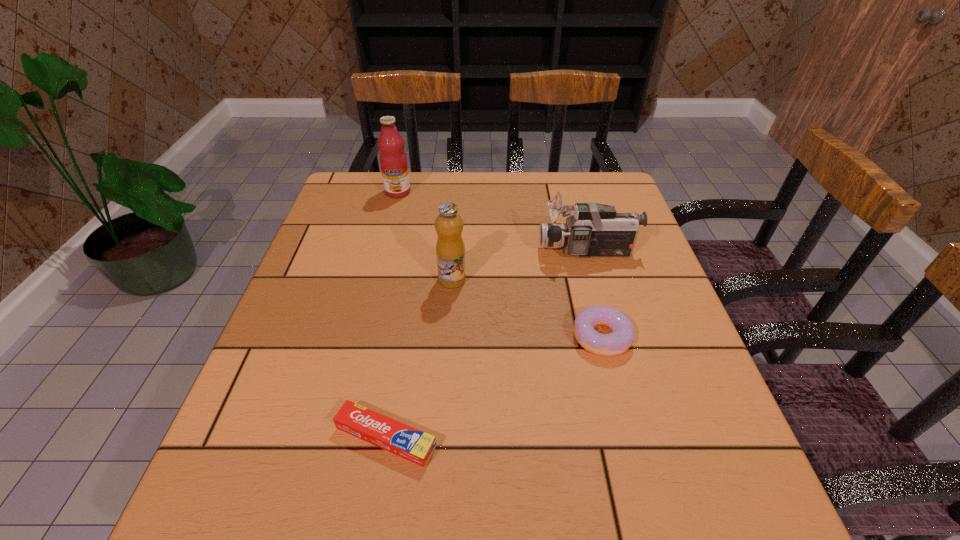
Locate an element on the screen. This screenshot has height=540, width=960. free space located 0.220m on the label of the left fruit juice is located at coordinates (384, 246).

Locate an element on the screen. free space located on the front label of the nearer fruit juice is located at coordinates (x=525, y=280).

You are a GUI agent. You are given a task and a screenshot of the screen. Output one action in this format:
    pyautogui.click(x=<x>, y=<y>)
    Task: Click on the vacant space situated on the front-facing side of the camcorder
    Image resolution: width=960 pixels, height=540 pixels.
    Given the screenshot: What is the action you would take?
    pyautogui.click(x=468, y=251)

Where is `vacant space located on the front-facing side of the camcorder`? vacant space located on the front-facing side of the camcorder is located at coordinates (429, 251).

Where is `vacant space located on the front-facing side of the camcorder`? This screenshot has height=540, width=960. vacant space located on the front-facing side of the camcorder is located at coordinates (468, 251).

At what (x,y) coordinates should I click in order to perform the action: click on vacant space located 0.180m on the back of the doughnut. Please return your answer as a coordinate pair (x, y). This screenshot has width=960, height=540. Looking at the image, I should click on (582, 261).

Where is `vacant space situated 0.090m on the right of the toothpaste`? The height and width of the screenshot is (540, 960). vacant space situated 0.090m on the right of the toothpaste is located at coordinates point(490,437).

Find the location of a particular element. This screenshot has height=540, width=960. object located in the far edge section of the desktop is located at coordinates (393, 161).

Where is `object at the left edge`? This screenshot has height=540, width=960. object at the left edge is located at coordinates (393, 161).

Locate an element on the screen. camcorder that is at the right edge is located at coordinates (592, 230).